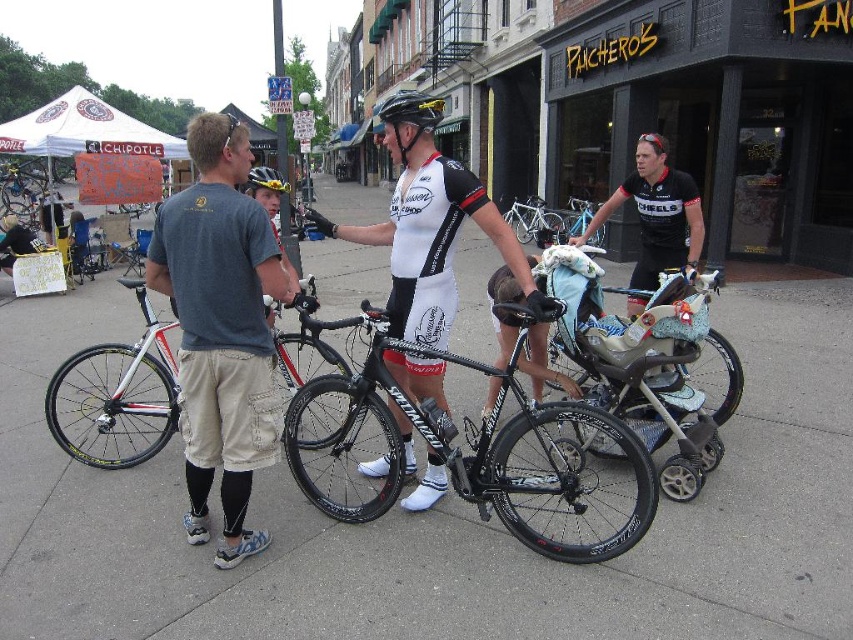
You are a street artist planning to paint a mural on the gray concrete pavement at center and the shiny black frame at center. Which surface would require more paint due to its size?

The gray concrete pavement at center requires more paint because it is bigger than the shiny black frame at center.

What is the coordinate of the shiny black frame at center?

The shiny black frame at center is located at coordinate point (469,445).